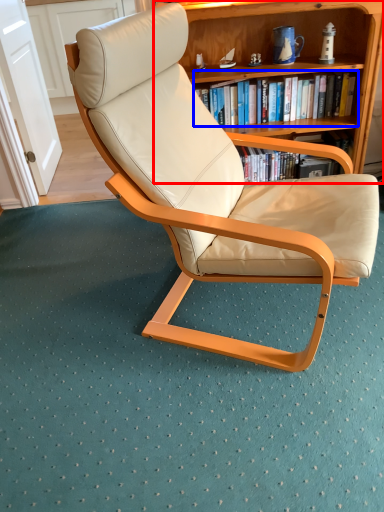
Question: Which object is further to the camera taking this photo, bookcase (highlighted by a red box) or book (highlighted by a blue box)?

Choices:
 (A) bookcase
 (B) book

Answer: (B)